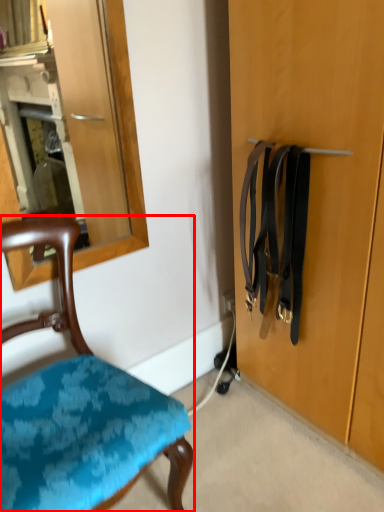
Question: In this image, where is chair (annotated by the red box) located relative to suspenders?

Choices:
 (A) right
 (B) left

Answer: (B)